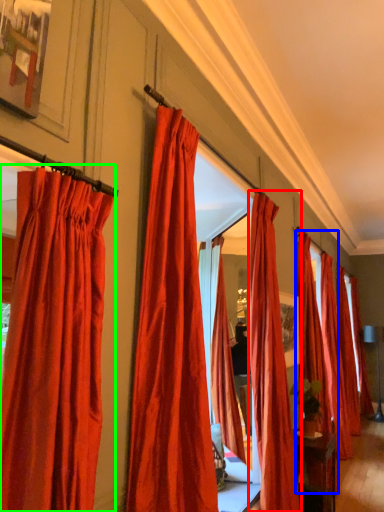
Question: Which object is positioned farthest from curtain (highlighted by a red box)? Select from curtain (highlighted by a blue box) and curtain (highlighted by a green box).

Choices:
 (A) curtain
 (B) curtain

Answer: (B)